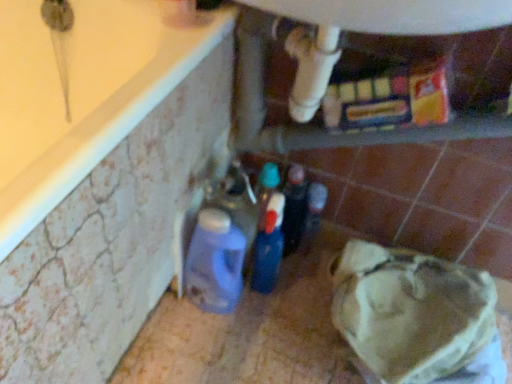
Question: Is translucent plastic bottle at center, positioned as the second bottle in left-to-right order, completely or partially outside of matte plastic detergent at lower left, arranged as the 2th bottle when viewed from the right?

Choices:
 (A) no
 (B) yes

Answer: (B)

Question: Can matte plastic detergent at lower left, positioned as the 1th bottle in left-to-right order, be found inside translucent plastic bottle at center, positioned as the second bottle in left-to-right order?

Choices:
 (A) no
 (B) yes

Answer: (A)

Question: Can you confirm if translucent plastic bottle at center, the 1th bottle viewed from the right, is positioned to the right of matte plastic detergent at lower left, positioned as the 1th bottle in left-to-right order?

Choices:
 (A) yes
 (B) no

Answer: (A)

Question: From a real-world perspective, is translucent plastic bottle at center, positioned as the second bottle in left-to-right order, on top of matte plastic detergent at lower left, arranged as the 2th bottle when viewed from the right?

Choices:
 (A) yes
 (B) no

Answer: (B)

Question: Can you confirm if translucent plastic bottle at center, positioned as the second bottle in left-to-right order, is taller than matte plastic detergent at lower left, positioned as the 1th bottle in left-to-right order?

Choices:
 (A) no
 (B) yes

Answer: (A)

Question: Is translucent plastic bottle at center, positioned as the second bottle in left-to-right order, smaller than matte plastic detergent at lower left, arranged as the 2th bottle when viewed from the right?

Choices:
 (A) yes
 (B) no

Answer: (A)

Question: Is matte plastic detergent at lower left, positioned as the 1th bottle in left-to-right order, bigger than translucent plastic bottle at center, the 1th bottle viewed from the right?

Choices:
 (A) yes
 (B) no

Answer: (A)

Question: Considering the relative positions of matte plastic detergent at lower left, arranged as the 2th bottle when viewed from the right, and translucent plastic bottle at center, positioned as the second bottle in left-to-right order, in the image provided, is matte plastic detergent at lower left, arranged as the 2th bottle when viewed from the right, to the left of translucent plastic bottle at center, positioned as the second bottle in left-to-right order, from the viewer's perspective?

Choices:
 (A) no
 (B) yes

Answer: (B)

Question: Is matte plastic detergent at lower left, positioned as the 1th bottle in left-to-right order, not within translucent plastic bottle at center, positioned as the second bottle in left-to-right order?

Choices:
 (A) yes
 (B) no

Answer: (A)

Question: Is matte plastic detergent at lower left, arranged as the 2th bottle when viewed from the right, not close to translucent plastic bottle at center, positioned as the second bottle in left-to-right order?

Choices:
 (A) yes
 (B) no

Answer: (B)

Question: From the image's perspective, would you say matte plastic detergent at lower left, arranged as the 2th bottle when viewed from the right, is shown under translucent plastic bottle at center, positioned as the second bottle in left-to-right order?

Choices:
 (A) no
 (B) yes

Answer: (B)

Question: Can you confirm if matte plastic detergent at lower left, arranged as the 2th bottle when viewed from the right, is smaller than translucent plastic bottle at center, positioned as the second bottle in left-to-right order?

Choices:
 (A) yes
 (B) no

Answer: (B)

Question: Is white plastic water heater at upper center positioned beyond the bounds of translucent plastic bottle at center, the 1th bottle viewed from the right?

Choices:
 (A) yes
 (B) no

Answer: (A)